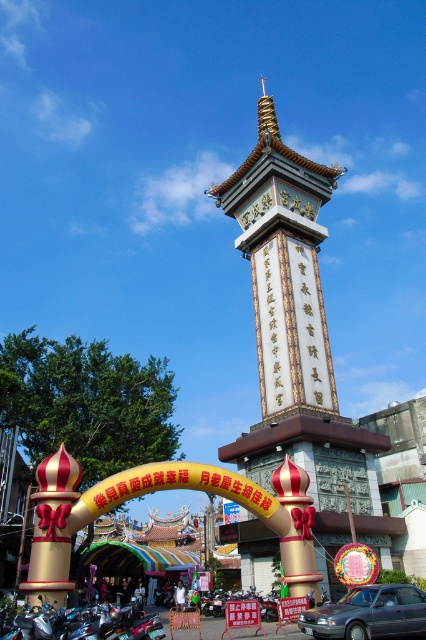
Question: Which object is closer to the camera taking this photo?

Choices:
 (A) metallic gray sedan at lower right
 (B) white stone tower at center

Answer: (A)

Question: Which object is closer to the camera taking this photo?

Choices:
 (A) white stone tower at center
 (B) metallic gray sedan at lower right

Answer: (B)

Question: Can you confirm if white stone tower at center is bigger than metallic gray sedan at lower right?

Choices:
 (A) yes
 (B) no

Answer: (A)

Question: Can you confirm if white stone tower at center is bigger than metallic gray sedan at lower right?

Choices:
 (A) no
 (B) yes

Answer: (B)

Question: Can you confirm if white stone tower at center is thinner than metallic gray sedan at lower right?

Choices:
 (A) yes
 (B) no

Answer: (B)